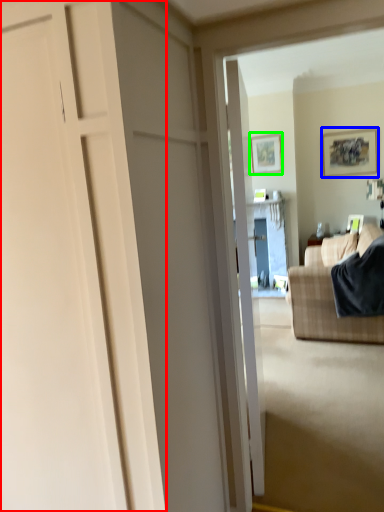
Question: Estimate the real-world distances between objects in this image. Which object is closer to door (highlighted by a red box), picture frame (highlighted by a blue box) or picture frame (highlighted by a green box)?

Choices:
 (A) picture frame
 (B) picture frame

Answer: (A)